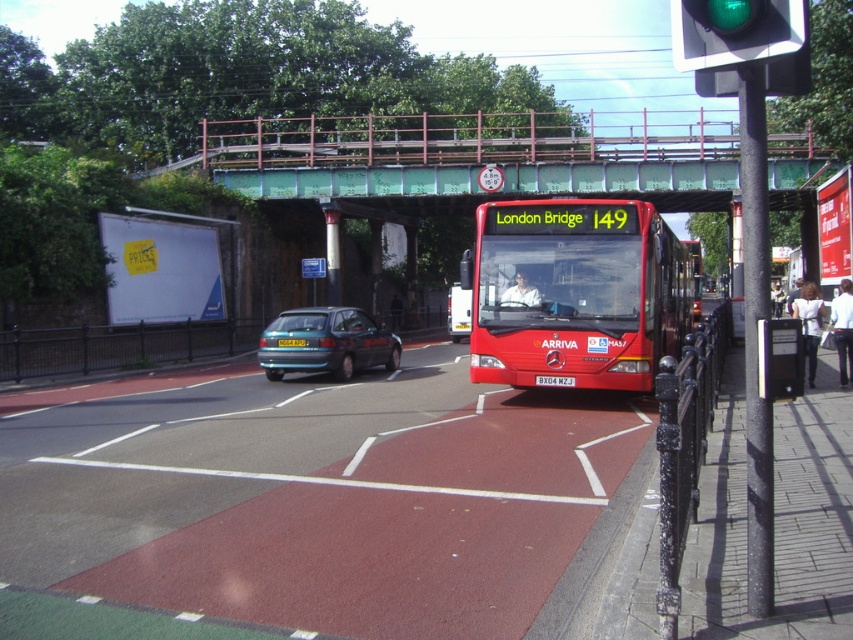
Does green glass traffic light at upper right have a greater width compared to teal metallic hatchback at center?

In fact, green glass traffic light at upper right might be narrower than teal metallic hatchback at center.

Does green glass traffic light at upper right have a greater height compared to teal metallic hatchback at center?

Yes, green glass traffic light at upper right is taller than teal metallic hatchback at center.

The image size is (853, 640). I want to click on green glass traffic light at upper right, so click(734, 32).

Who is more distant from viewer, (527, 170) or (296, 339)?

Positioned behind is point (527, 170).

Is green painted steel bridge at upper center further to the viewer compared to yellow metallic license plate at center?

Yes, green painted steel bridge at upper center is behind yellow metallic license plate at center.

Locate an element on the screen. green painted steel bridge at upper center is located at coordinates (473, 156).

Between red matte bus at center and yellow metallic license plate at center, which one has less height?

Standing shorter between the two is yellow metallic license plate at center.

Can you confirm if red matte bus at center is shorter than yellow metallic license plate at center?

Incorrect, red matte bus at center's height does not fall short of yellow metallic license plate at center's.

Where is `red matte bus at center`? red matte bus at center is located at coordinates (575, 292).